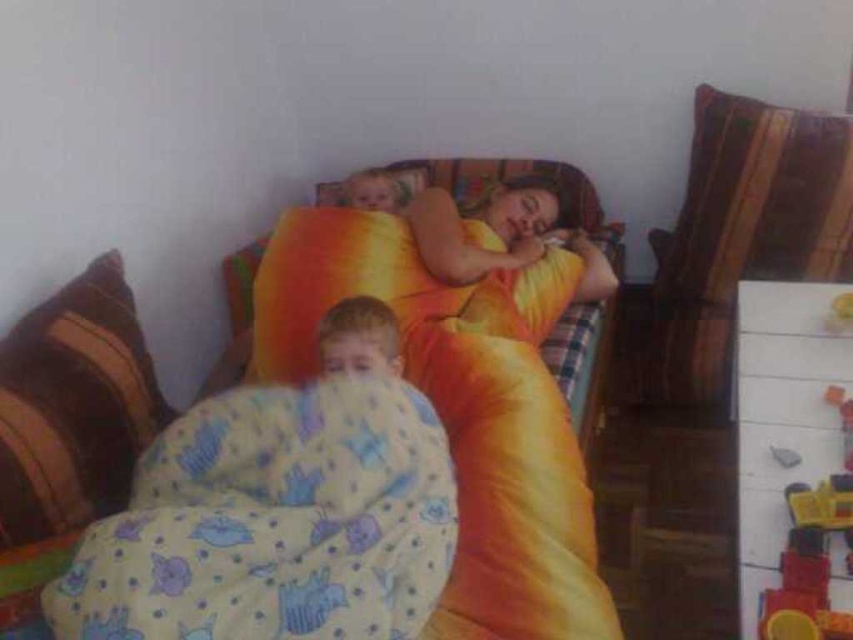
Question: Among these points, which one is farthest from the camera?

Choices:
 (A) (846, 323)
 (B) (698, 236)
 (C) (477, 484)

Answer: (B)

Question: Which point appears farthest from the camera in this image?

Choices:
 (A) (379, 376)
 (B) (836, 304)
 (C) (100, 467)
 (D) (753, 132)

Answer: (D)

Question: Does smooth yellow blanket at lower center have a greater width compared to yellow plastic toy at upper right?

Choices:
 (A) yes
 (B) no

Answer: (A)

Question: Is striped fabric pillow at left to the left of smooth yellow blanket at lower center from the viewer's perspective?

Choices:
 (A) yes
 (B) no

Answer: (A)

Question: Which object is the closest to the striped fabric pillow at upper right?

Choices:
 (A) yellow cotton blanket at lower left
 (B) yellow plastic toy at upper right

Answer: (B)

Question: Is smooth yellow blanket at lower center bigger than smooth yellow pillow at upper center?

Choices:
 (A) yes
 (B) no

Answer: (B)